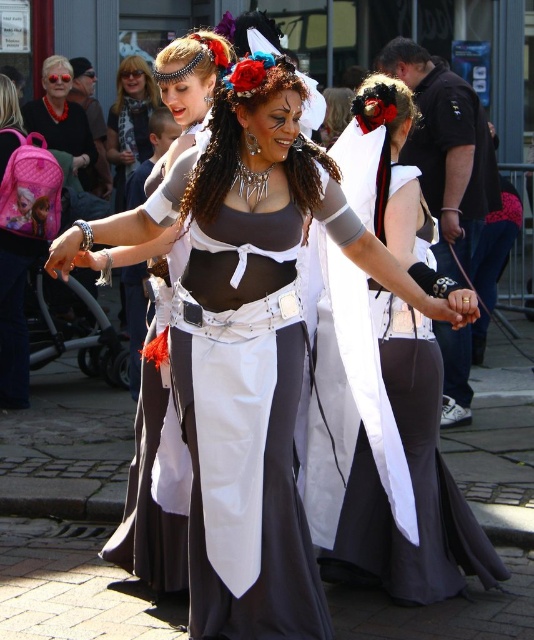
You are a photographer trying to capture the central figure in the image. You notice the matte white dress at center and the shiny silver necklace at center. Which object should you focus on to ensure it takes up more space in your photo?

The matte white dress at center has a larger size compared to the shiny silver necklace at center, so focusing on it will ensure it takes up more space in the photo.

You are a photographer at the festival and need to capture the central figure. Which object, the matte white dress at center or the shiny silver necklace at center, should you focus on first if you want to ensure the lower part of the outfit is in sharp focus?

The matte white dress at center is located below the shiny silver necklace at center, so focusing on the matte white dress at center will ensure the lower part of the outfit is in sharp focus.